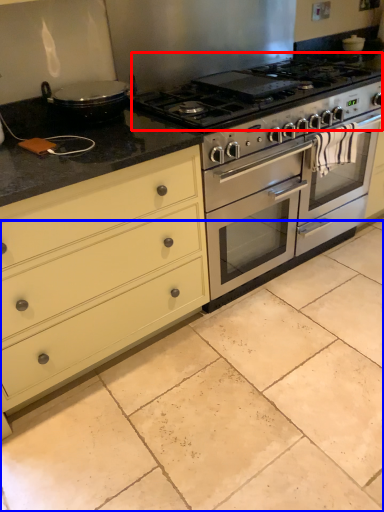
Question: Which of the following is the farthest to the observer, gas stove (highlighted by a red box) or ceramic tile (highlighted by a blue box)?

Choices:
 (A) gas stove
 (B) ceramic tile

Answer: (A)